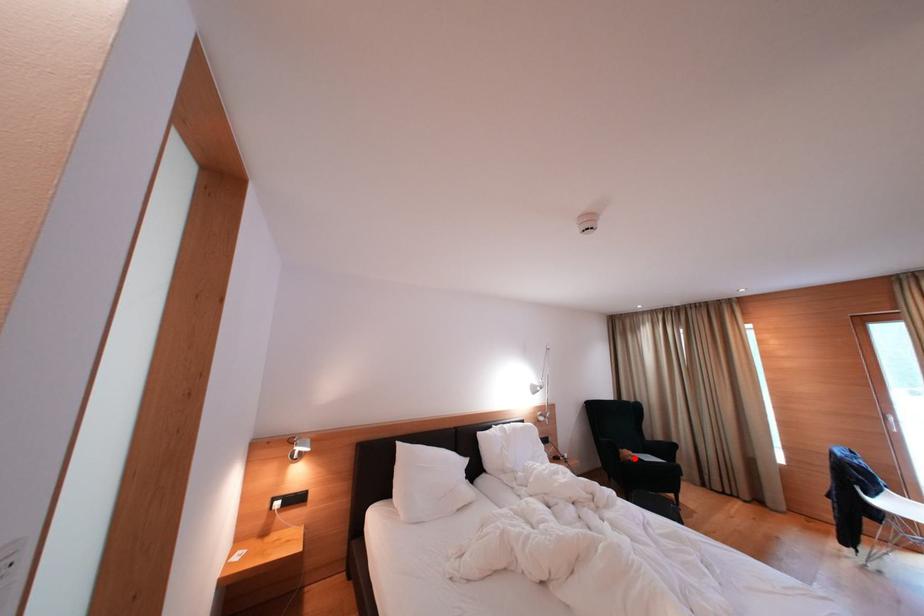
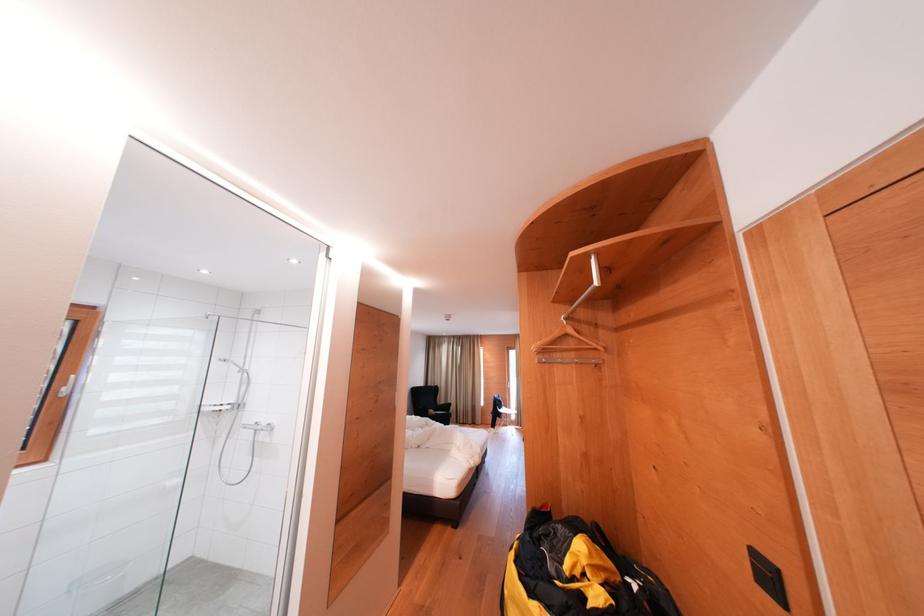
In the second image, find the point that corresponds to the highlighted location in the first image.

(439, 416)